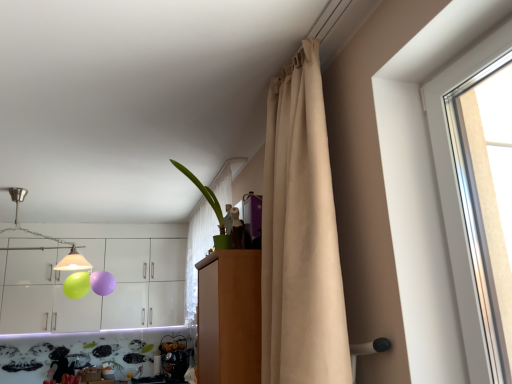
Where is `beige fabric curtain at upper right`? The width and height of the screenshot is (512, 384). beige fabric curtain at upper right is located at coordinates (300, 236).

You are a GUI agent. You are given a task and a screenshot of the screen. Output one action in this format:
    pyautogui.click(x=<x>, y=<y>)
    Task: Click on the wooden cabinet at center
    This screenshot has width=512, height=384.
    Given the screenshot: What is the action you would take?
    pyautogui.click(x=229, y=317)

The image size is (512, 384). In order to click on beige fabric curtain at upper right in this screenshot , I will do `click(300, 236)`.

Which object is closer to the camera taking this photo, beige fabric curtain at upper right or green matte plant at upper center?

beige fabric curtain at upper right is closer to the camera.

Is beige fabric curtain at upper right facing away from green matte plant at upper center?

No, beige fabric curtain at upper right is not facing the opposite direction of green matte plant at upper center.

In the scene shown: What's the angular difference between beige fabric curtain at upper right and green matte plant at upper center's facing directions?

The facing directions of beige fabric curtain at upper right and green matte plant at upper center are 27.7 degrees apart.

Is beige fabric curtain at upper right directly adjacent to green matte plant at upper center?

No, beige fabric curtain at upper right is not with green matte plant at upper center.

From a real-world perspective, is wooden cabinet at center positioned above or below white glossy cabinets at upper left?

From a real-world perspective, wooden cabinet at center is physically below white glossy cabinets at upper left.

Identify the location of dresser in front of the white glossy cabinets at upper left. The image size is (512, 384). (229, 317).

Measure the distance between wooden cabinet at center and white glossy cabinets at upper left.

wooden cabinet at center and white glossy cabinets at upper left are 3.32 meters apart from each other.

Is point (232, 330) closer to camera compared to point (69, 311)?

Yes, it is in front of point (69, 311).

Does green matte plant at upper center have a larger size compared to beige fabric curtain at upper right?

Actually, green matte plant at upper center might be smaller than beige fabric curtain at upper right.

Which is less distant, (220,245) or (343,303)?

Point (343,303)

How many degrees apart are the facing directions of green matte plant at upper center and beige fabric curtain at upper right?

The angle between the facing direction of green matte plant at upper center and the facing direction of beige fabric curtain at upper right is 27.7 degrees.

Does green matte plant at upper center have a greater height compared to beige fabric curtain at upper right?

No.

Does wooden cabinet at center come behind green matte plant at upper center?

No, wooden cabinet at center is closer to the viewer.

Is wooden cabinet at center oriented away from green matte plant at upper center?

No, green matte plant at upper center is not at the back of wooden cabinet at center.

Which of these two, wooden cabinet at center or green matte plant at upper center, is thinner?

green matte plant at upper center is thinner.

Is green matte plant at upper center surrounded by wooden cabinet at center?

No, wooden cabinet at center does not contain green matte plant at upper center.

Could you tell me if green matte plant at upper center is turned towards white glossy cabinets at upper left?

No, green matte plant at upper center does not turn towards white glossy cabinets at upper left.

In the image, is green matte plant at upper center positioned in front of or behind white glossy cabinets at upper left?

Visually, green matte plant at upper center is located in front of white glossy cabinets at upper left.

The image size is (512, 384). I want to click on cabinetry below the green matte plant at upper center (from a real-world perspective), so click(93, 292).

Is green matte plant at upper center taller or shorter than white glossy cabinets at upper left?

Clearly, green matte plant at upper center is shorter compared to white glossy cabinets at upper left.

Looking at this image, is green matte plant at upper center to the right of wooden cabinet at center from the viewer's perspective?

In fact, green matte plant at upper center is to the left of wooden cabinet at center.

Does green matte plant at upper center have a smaller size compared to wooden cabinet at center?

Yes, green matte plant at upper center is smaller than wooden cabinet at center.

From the image's perspective, would you say green matte plant at upper center is shown under wooden cabinet at center?

No, from the image's perspective, green matte plant at upper center is not below wooden cabinet at center.

Is green matte plant at upper center not inside wooden cabinet at center?

green matte plant at upper center is positioned outside wooden cabinet at center.

How many degrees apart are the facing directions of brushed metal lampshade at upper left and green matte plant at upper center?

The facing directions of brushed metal lampshade at upper left and green matte plant at upper center are 118 degrees apart.

Considering the sizes of objects brushed metal lampshade at upper left and green matte plant at upper center in the image provided, who is bigger, brushed metal lampshade at upper left or green matte plant at upper center?

brushed metal lampshade at upper left is bigger.

From the image's perspective, which one is positioned lower, brushed metal lampshade at upper left or green matte plant at upper center?

brushed metal lampshade at upper left appears lower in the image.

Find the location of a particular element. This screenshot has width=512, height=384. curtain on the right of green matte plant at upper center is located at coordinates (300, 236).

Find the location of `dresser in front of the white glossy cabinets at upper left`. dresser in front of the white glossy cabinets at upper left is located at coordinates (229, 317).

When comparing their distances from wooden cabinet at center, does white glossy cabinets at upper left or green matte plant at upper center seem further?

white glossy cabinets at upper left lies further to wooden cabinet at center than the other object.

Looking at the image, which one is located further to green matte plant at upper center, brushed metal lampshade at upper left or wooden cabinet at center?

Based on the image, brushed metal lampshade at upper left appears to be further to green matte plant at upper center.

Which object lies further to the anchor point green matte plant at upper center, white glossy cabinets at upper left or brushed metal lampshade at upper left?

Among the two, brushed metal lampshade at upper left is located further to green matte plant at upper center.

From the image, which object appears to be nearer to brushed metal lampshade at upper left, wooden cabinet at center or green matte plant at upper center?

The object closer to brushed metal lampshade at upper left is green matte plant at upper center.

Based on their spatial positions, is wooden cabinet at center or brushed metal lampshade at upper left closer to green matte plant at upper center?

wooden cabinet at center is closer to green matte plant at upper center.

From the image, which object appears to be nearer to beige fabric curtain at upper right, green matte plant at upper center or brushed metal lampshade at upper left?

Based on the image, green matte plant at upper center appears to be nearer to beige fabric curtain at upper right.

When comparing their distances from beige fabric curtain at upper right, does white glossy cabinets at upper left or wooden cabinet at center seem closer?

The object closer to beige fabric curtain at upper right is wooden cabinet at center.

Based on their spatial positions, is white glossy cabinets at upper left or beige fabric curtain at upper right further from wooden cabinet at center?

white glossy cabinets at upper left.

Image resolution: width=512 pixels, height=384 pixels. In order to click on dresser between beige fabric curtain at upper right and brushed metal lampshade at upper left from front to back in this screenshot , I will do `click(229, 317)`.

Where is `dresser located between beige fabric curtain at upper right and white glossy cabinets at upper left in the depth direction`? dresser located between beige fabric curtain at upper right and white glossy cabinets at upper left in the depth direction is located at coordinates click(x=229, y=317).

In order to click on houseplant between wooden cabinet at center and white glossy cabinets at upper left in the front-back direction in this screenshot , I will do `click(211, 207)`.

Image resolution: width=512 pixels, height=384 pixels. Find the location of `lamp positioned between green matte plant at upper center and white glossy cabinets at upper left from near to far`. lamp positioned between green matte plant at upper center and white glossy cabinets at upper left from near to far is located at coordinates (46, 237).